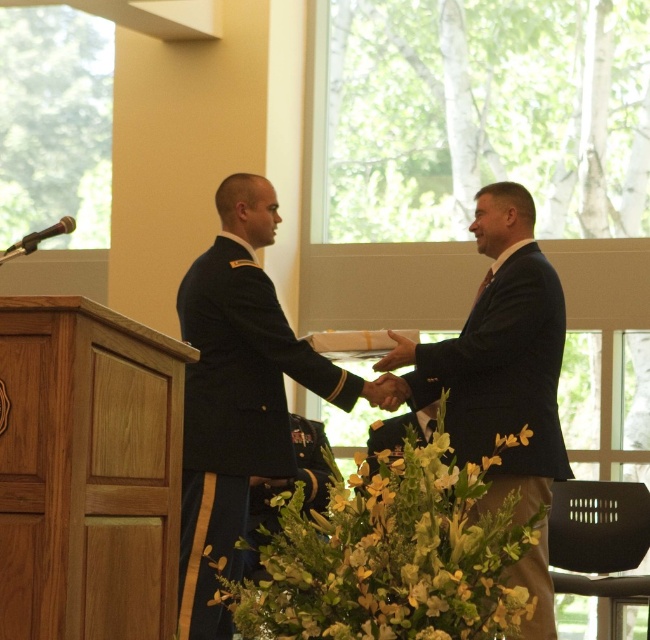
Does navy blue fabric uniform at center have a larger size compared to dark blue suit at center?

Yes.

Who is more distant from viewer, (213,301) or (486,324)?

Point (213,301)

Locate an element on the screen. navy blue fabric uniform at center is located at coordinates point(235,413).

Between green leafy plant at center and dark blue suit at center, which one is positioned higher?

Positioned higher is dark blue suit at center.

Can you confirm if green leafy plant at center is taller than dark blue suit at center?

No.

Who is more distant from viewer, (341, 614) or (533, 500)?

The point (533, 500) is more distant.

Identify the location of green leafy plant at center. This screenshot has height=640, width=650. click(387, 554).

Between green leafy plant at center and navy blue fabric uniform at center, which one appears on the right side from the viewer's perspective?

green leafy plant at center is more to the right.

Can you confirm if green leafy plant at center is smaller than navy blue fabric uniform at center?

Correct, green leafy plant at center occupies less space than navy blue fabric uniform at center.

At what (x,y) coordinates should I click in order to perform the action: click on green leafy plant at center. Please return your answer as a coordinate pair (x, y). This screenshot has height=640, width=650. Looking at the image, I should click on (387, 554).